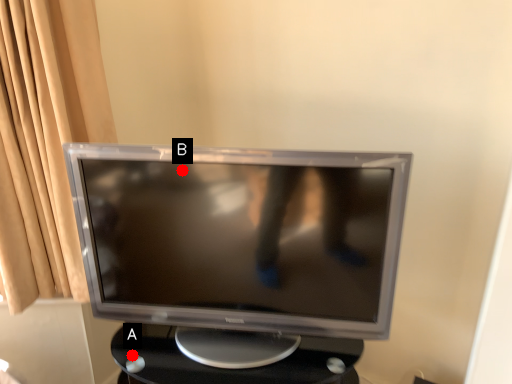
Question: Two points are circled on the image, labeled by A and B beside each circle. Which point appears closest to the camera in this image?

Choices:
 (A) A is closer
 (B) B is closer

Answer: (B)